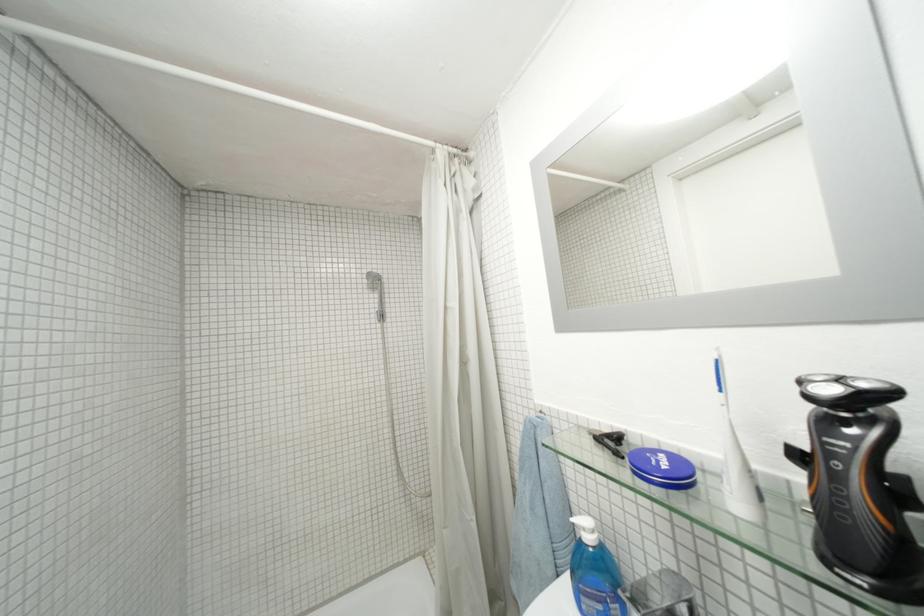
Find where to press the soap dispenser pump. Please return your answer as a coordinate pair (x, y).

(586, 529)